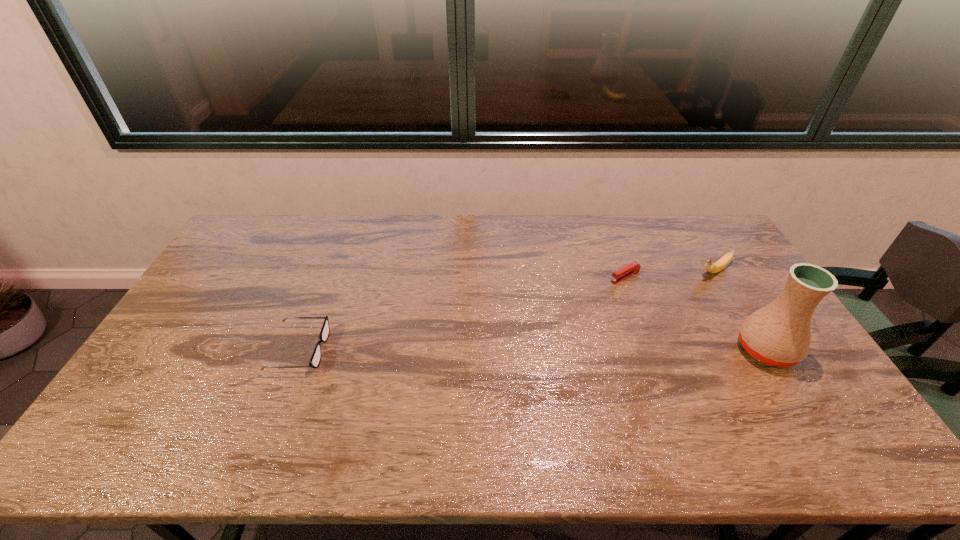
The height and width of the screenshot is (540, 960). Find the location of `vacant area situated 0.290m at the stem of the banana`. vacant area situated 0.290m at the stem of the banana is located at coordinates (643, 314).

At what (x,y) coordinates should I click in order to perform the action: click on free space located 0.310m at the stem of the banana. Please return your answer as a coordinate pair (x, y). Looking at the image, I should click on (639, 317).

Where is `pottery at the right edge`? The width and height of the screenshot is (960, 540). pottery at the right edge is located at coordinates (778, 334).

Where is `banana that is positioned at the right edge`? This screenshot has height=540, width=960. banana that is positioned at the right edge is located at coordinates coord(711,267).

Where is `free space at the far edge of the desktop`? This screenshot has height=540, width=960. free space at the far edge of the desktop is located at coordinates (451, 239).

The image size is (960, 540). Identify the location of free spot at the near edge of the desktop. (641, 393).

Identify the location of free space at the right edge of the desktop. This screenshot has height=540, width=960. (759, 286).

This screenshot has width=960, height=540. What are the coordinates of `vacant space at the far left corner` in the screenshot? It's located at (270, 235).

Locate an element on the screen. This screenshot has height=540, width=960. vacant space at the near left corner of the desktop is located at coordinates (180, 395).

This screenshot has width=960, height=540. Identify the location of free space at the far right corner of the desktop. (693, 246).